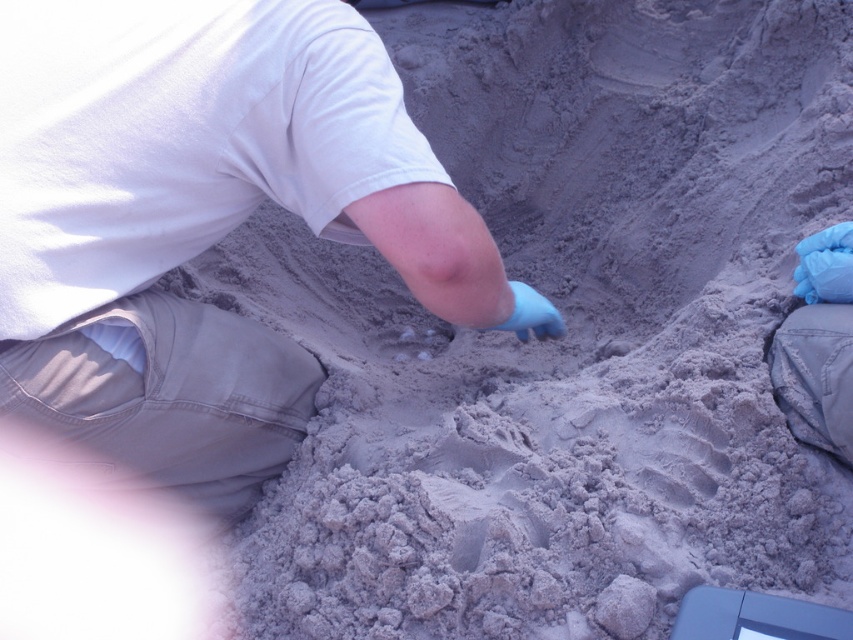
Question: Is white matte shirt at center positioned behind blue denim pants at lower right?

Choices:
 (A) no
 (B) yes

Answer: (A)

Question: Is the position of white matte shirt at center less distant than that of blue denim pants at lower right?

Choices:
 (A) yes
 (B) no

Answer: (A)

Question: Among these objects, which one is nearest to the camera?

Choices:
 (A) blue denim pants at lower right
 (B) white matte shirt at center

Answer: (B)

Question: Observing the image, what is the correct spatial positioning of white matte shirt at center in reference to blue denim pants at lower right?

Choices:
 (A) above
 (B) below

Answer: (A)